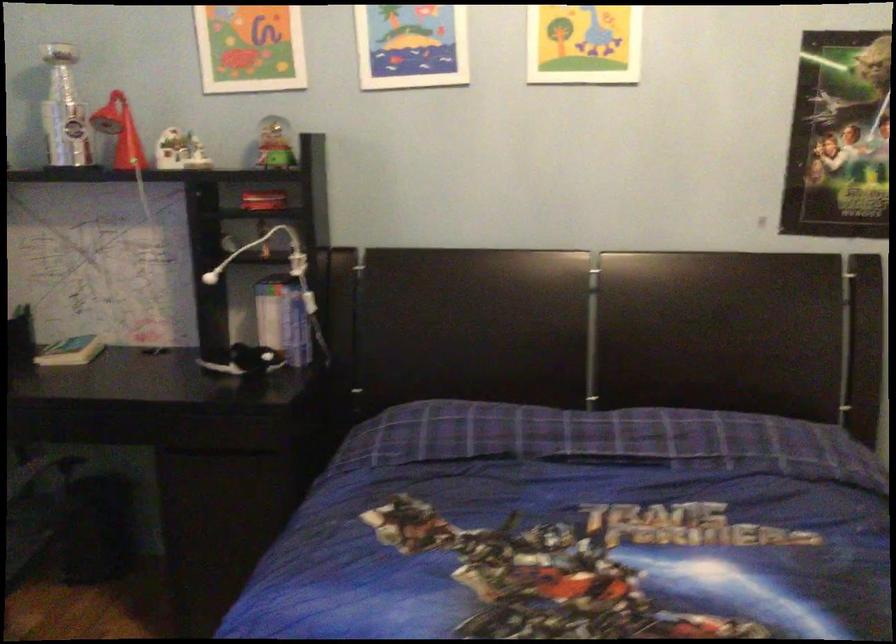
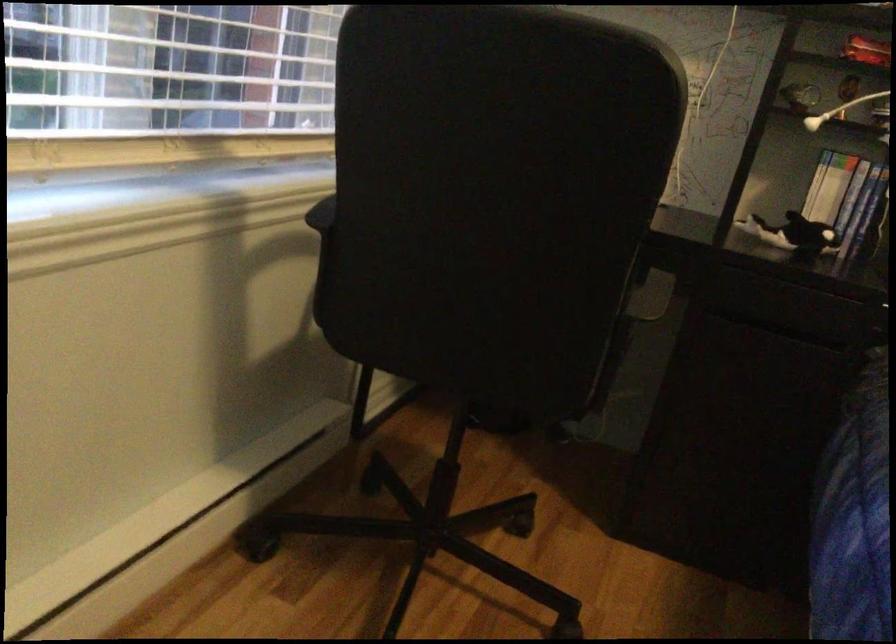
Locate, in the second image, the point that corresponds to point 238,359 in the first image.

(793, 234)